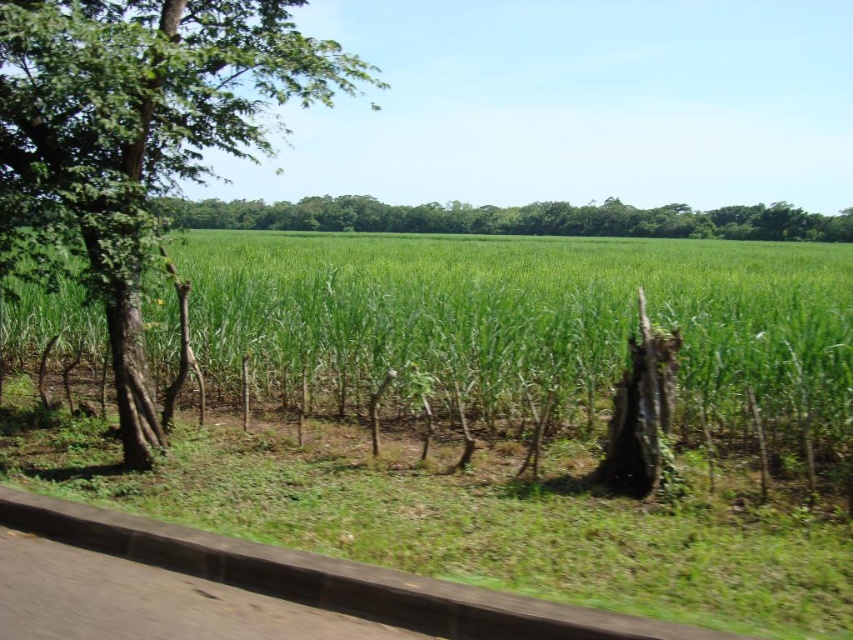
In the scene shown: Is green grassy field at center smaller than green leafy tree at left?

Yes, green grassy field at center is smaller than green leafy tree at left.

Does green grassy field at center lie behind green leafy tree at left?

That is True.

Is point (260, 273) positioned before point (126, 298)?

No, (260, 273) is behind (126, 298).

This screenshot has width=853, height=640. I want to click on green grassy field at center, so click(535, 328).

Identify the location of green grassy field at center. (535, 328).

Does green leafy tree at left appear under green leafy tree at center?

No, green leafy tree at left is not below green leafy tree at center.

Which is below, green leafy tree at left or green leafy tree at center?

green leafy tree at center is lower down.

Identify the location of green leafy tree at left. This screenshot has height=640, width=853. (140, 132).